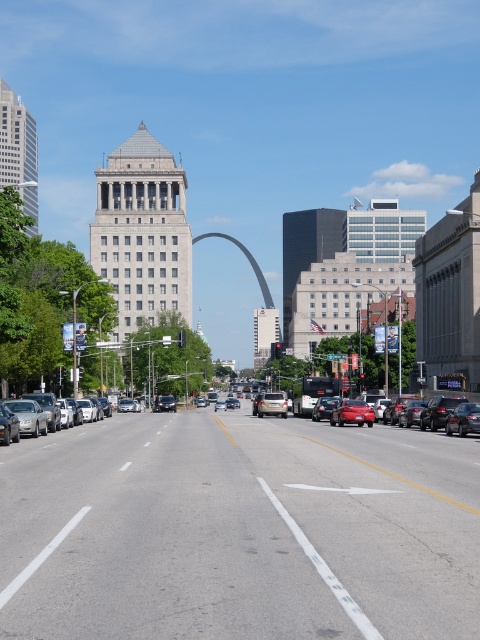
You are standing on the street in front of the Gateway Arch and want to walk to the point that is closer to you. Which point should you head towards, point 1 at coordinates (263, 400) or point 2 at coordinates (222, 403)?

You should head towards point 1 at coordinates (263, 400) because it is closer to you than point 2 at coordinates (222, 403).